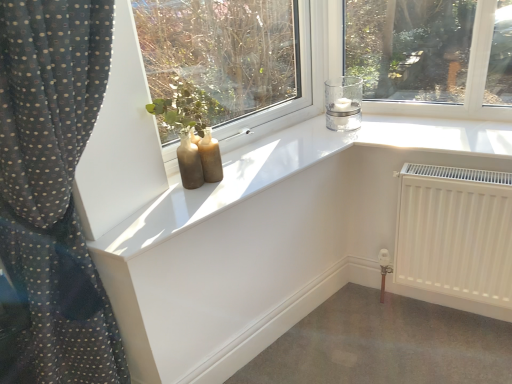
Question: Considering the relative sizes of clear glass candle at upper right and white matte radiator at lower right in the image provided, is clear glass candle at upper right smaller than white matte radiator at lower right?

Choices:
 (A) no
 (B) yes

Answer: (B)

Question: Considering the relative sizes of clear glass candle at upper right and white matte radiator at lower right in the image provided, is clear glass candle at upper right bigger than white matte radiator at lower right?

Choices:
 (A) no
 (B) yes

Answer: (A)

Question: Can you confirm if clear glass candle at upper right is thinner than white matte radiator at lower right?

Choices:
 (A) no
 (B) yes

Answer: (A)

Question: From a real-world perspective, is clear glass candle at upper right positioned under white matte radiator at lower right based on gravity?

Choices:
 (A) yes
 (B) no

Answer: (B)

Question: Is clear glass candle at upper right at the left side of white matte radiator at lower right?

Choices:
 (A) yes
 (B) no

Answer: (A)

Question: Is matte glass bottles at center inside or outside of clear glass candle at upper right?

Choices:
 (A) outside
 (B) inside

Answer: (A)

Question: Based on their positions, is matte glass bottles at center located to the left or right of clear glass candle at upper right?

Choices:
 (A) left
 (B) right

Answer: (A)

Question: Based on their sizes in the image, would you say matte glass bottles at center is bigger or smaller than clear glass candle at upper right?

Choices:
 (A) big
 (B) small

Answer: (A)

Question: Is matte glass bottles at center wider or thinner than clear glass candle at upper right?

Choices:
 (A) wide
 (B) thin

Answer: (B)

Question: Considering their positions, is matte glass bottles at center located in front of or behind white matte radiator at lower right?

Choices:
 (A) behind
 (B) front

Answer: (B)

Question: From the image's perspective, is matte glass bottles at center above or below white matte radiator at lower right?

Choices:
 (A) below
 (B) above

Answer: (B)

Question: Considering the positions of matte glass bottles at center and white matte radiator at lower right in the image, is matte glass bottles at center wider or thinner than white matte radiator at lower right?

Choices:
 (A) wide
 (B) thin

Answer: (B)

Question: Based on their positions, is matte glass bottles at center located to the left or right of white matte radiator at lower right?

Choices:
 (A) left
 (B) right

Answer: (A)

Question: From a real-world perspective, is clear glass candle at upper right positioned above or below matte glass bottles at center?

Choices:
 (A) below
 (B) above

Answer: (A)

Question: From the image's perspective, is clear glass candle at upper right located above or below matte glass bottles at center?

Choices:
 (A) above
 (B) below

Answer: (B)